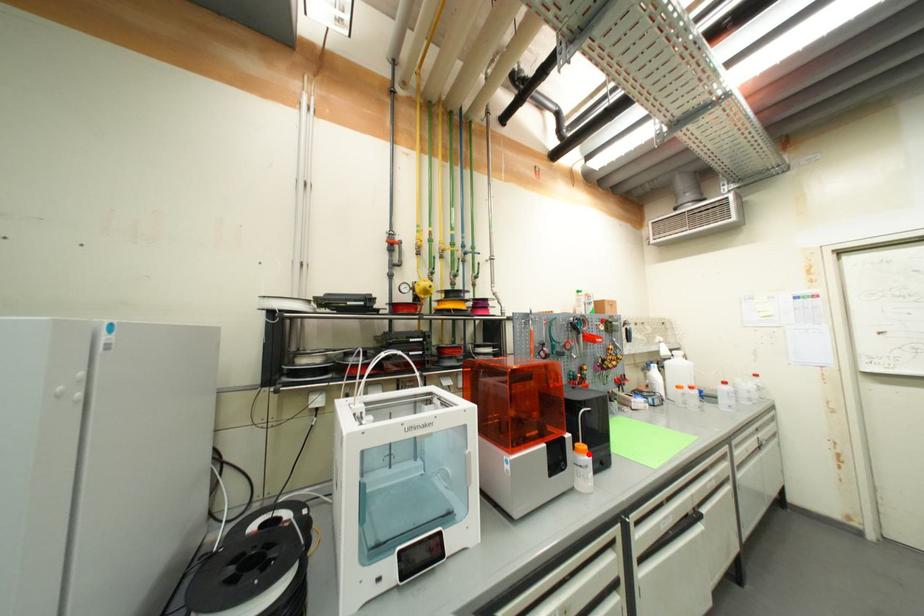
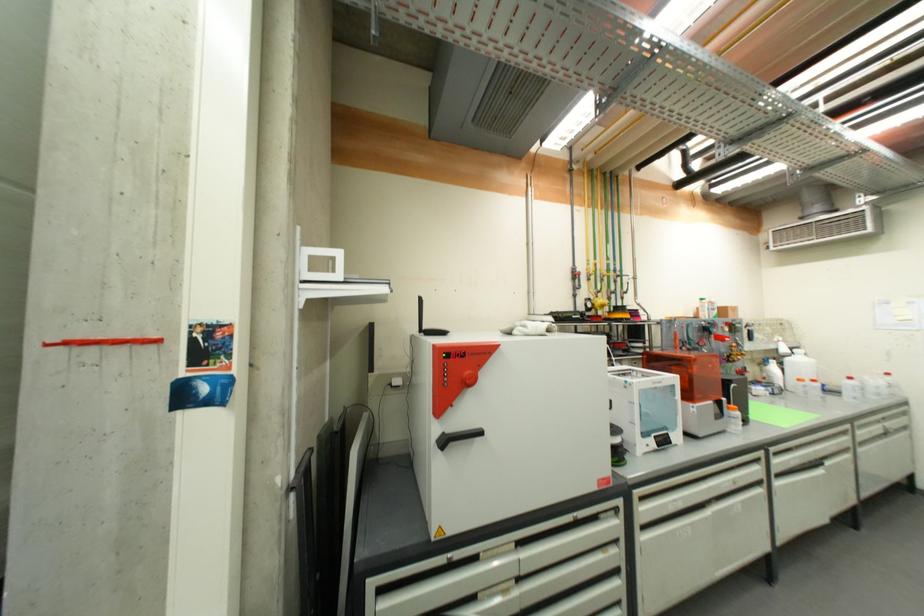
Find the pixel in the second image that matches the highlighted location in the first image.

(739, 411)